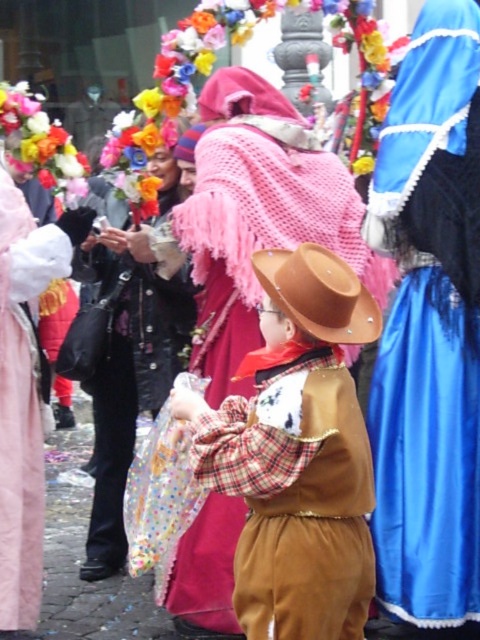
Question: Is blue satin dress at center in front of brown leather cowboy hat at center?

Choices:
 (A) yes
 (B) no

Answer: (B)

Question: Can you confirm if blue satin dress at center is positioned to the right of fluffy fabric flowers at upper left?

Choices:
 (A) no
 (B) yes

Answer: (B)

Question: Which object is positioned closest to the brown leather cowboy hat at center?

Choices:
 (A) blue satin dress at center
 (B) brown plaid shirt at center
 (C) fluffy fabric flowers at upper left
 (D) black leather jacket at left

Answer: (B)

Question: Considering the relative positions of brown plaid shirt at center and brown leather cowboy hat at center in the image provided, where is brown plaid shirt at center located with respect to brown leather cowboy hat at center?

Choices:
 (A) left
 (B) right

Answer: (A)

Question: Among these objects, which one is nearest to the camera?

Choices:
 (A) fluffy fabric flowers at upper left
 (B) brown plaid shirt at center
 (C) brown leather cowboy hat at center

Answer: (B)

Question: Which object appears farthest from the camera in this image?

Choices:
 (A) brown plaid shirt at center
 (B) brown leather cowboy hat at center

Answer: (B)